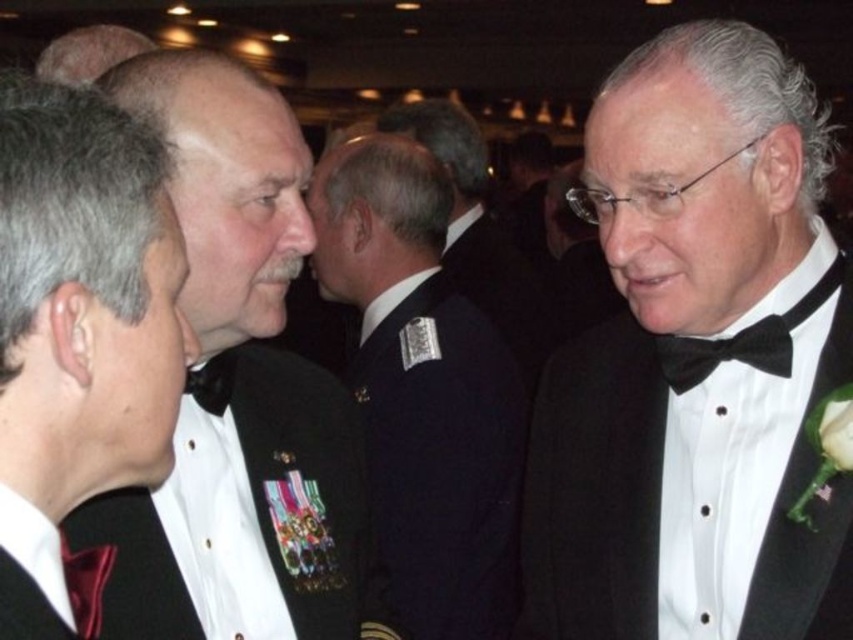
You are at a formal event and want to take a photo of the two points mentioned. Which point, point (666,515) or point (787,340), will appear larger in your photo?

Point (666,515) is further to the camera than point (787,340), so it will appear larger in the photo.

Based on the scene description, which object is positioned higher in the image, the black satin tuxedo at right or the navy blue fabric at center?

The black satin tuxedo at right is located above the navy blue fabric at center, so it is positioned higher in the image.

You are a photographer at a formal event. You need to capture a closeup shot of the black satin bow tie at right without including the black satin tuxedo at right in the frame. Is this possible given their spatial relationship?

The black satin tuxedo at right is taller than the black satin bow tie at right. Since the tuxedo is taller, it may block the view of the bow tie if positioned directly in front. However, if the camera angle can be adjusted to position the bow tie lower in the frame while excluding the tuxedo, it might be possible. Alternatively, moving closer to the bow tie could isolate it from the tuxedo.